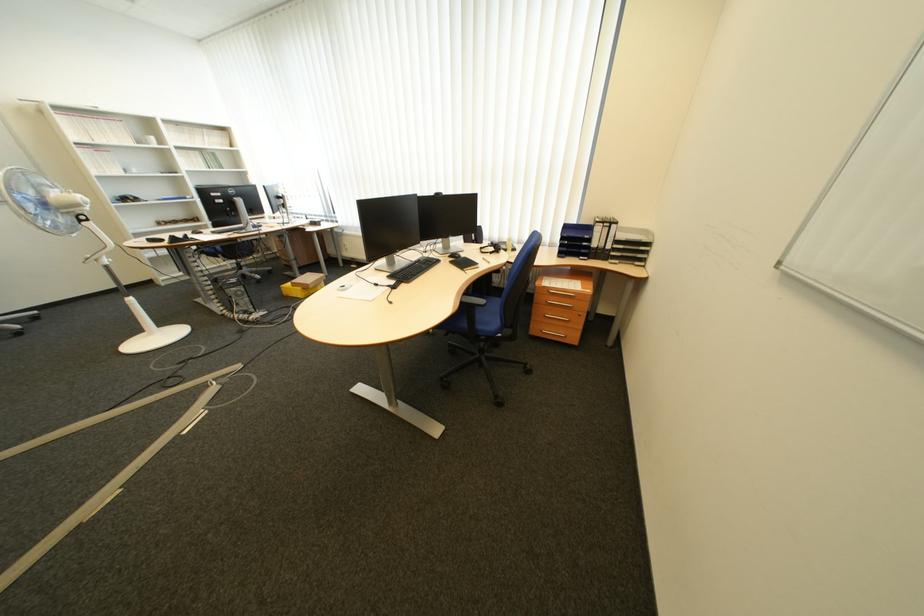
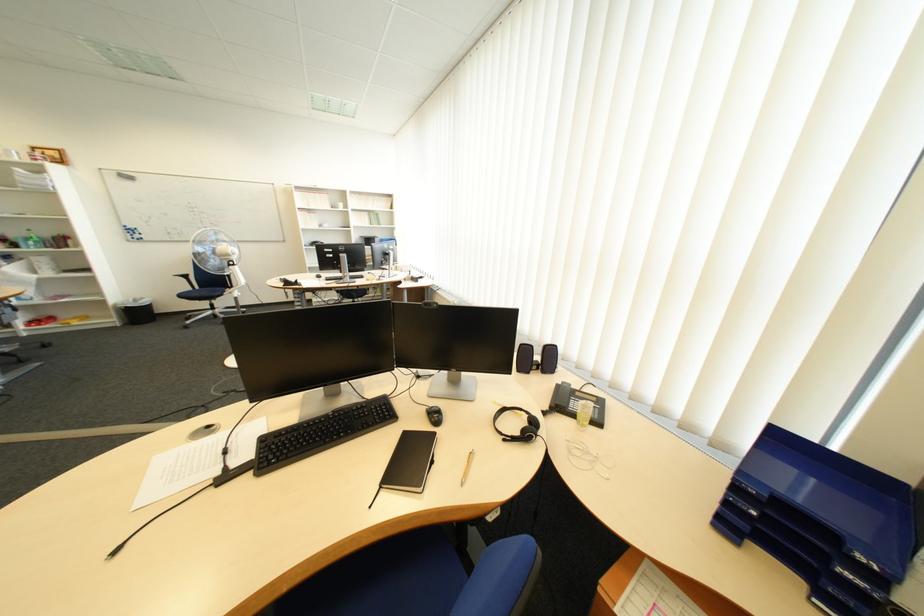
In the second image, find the point that corresponds to point 579,244 in the first image.

(767, 514)